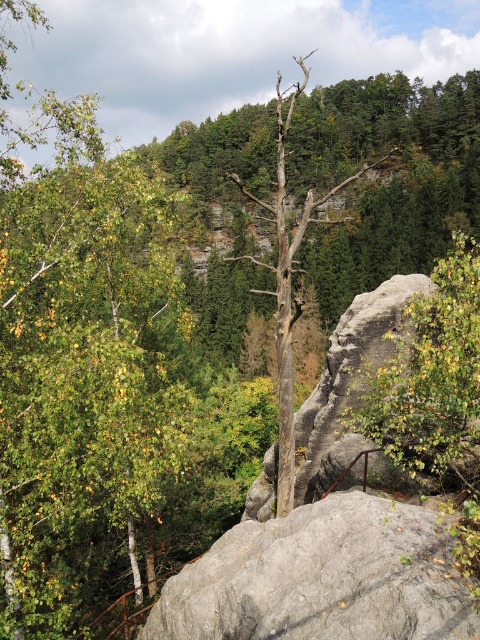
Question: Which point appears closest to the camera in this image?

Choices:
 (A) click(x=450, y=596)
 (B) click(x=444, y=337)

Answer: (A)

Question: Does gray rough boulder at center appear over green leafy shrub at right?

Choices:
 (A) no
 (B) yes

Answer: (A)

Question: Which point appears closest to the camera in this image?

Choices:
 (A) (464, 284)
 (B) (348, 525)

Answer: (A)

Question: Can you confirm if gray rough boulder at center is positioned to the left of green leafy shrub at right?

Choices:
 (A) no
 (B) yes

Answer: (B)

Question: Does gray rough boulder at center come in front of green leafy shrub at right?

Choices:
 (A) no
 (B) yes

Answer: (A)